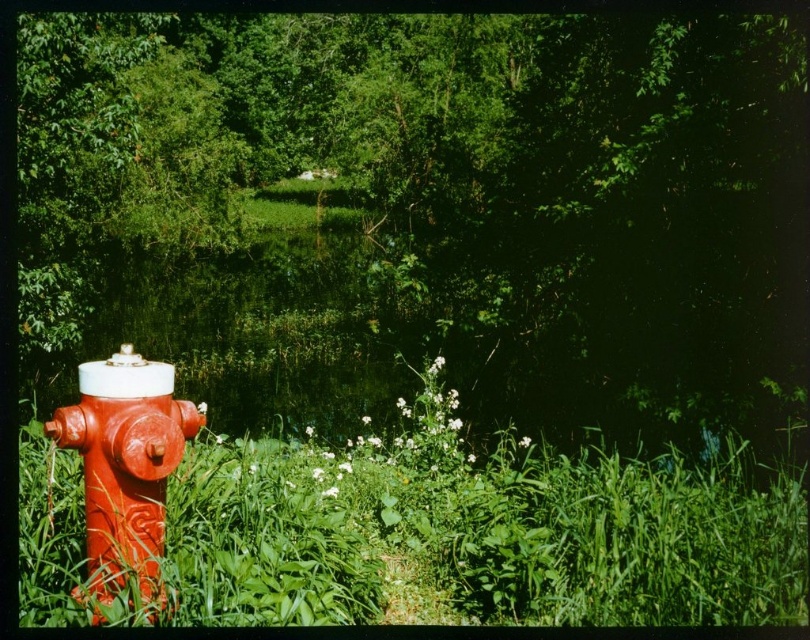
Question: Which of the following is the farthest from the observer?

Choices:
 (A) green leafy tree at left
 (B) shiny red fire hydrant at left

Answer: (A)

Question: Can you confirm if green leafy tree at left is smaller than shiny red fire hydrant at left?

Choices:
 (A) yes
 (B) no

Answer: (B)

Question: Is green leafy tree at left smaller than shiny red fire hydrant at left?

Choices:
 (A) yes
 (B) no

Answer: (B)

Question: Is green leafy tree at left thinner than shiny red fire hydrant at left?

Choices:
 (A) yes
 (B) no

Answer: (B)